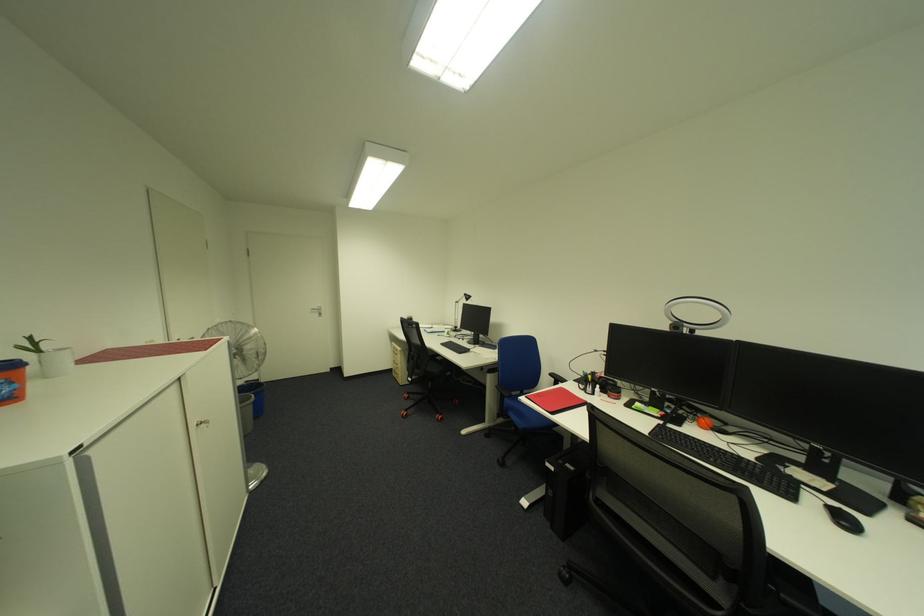
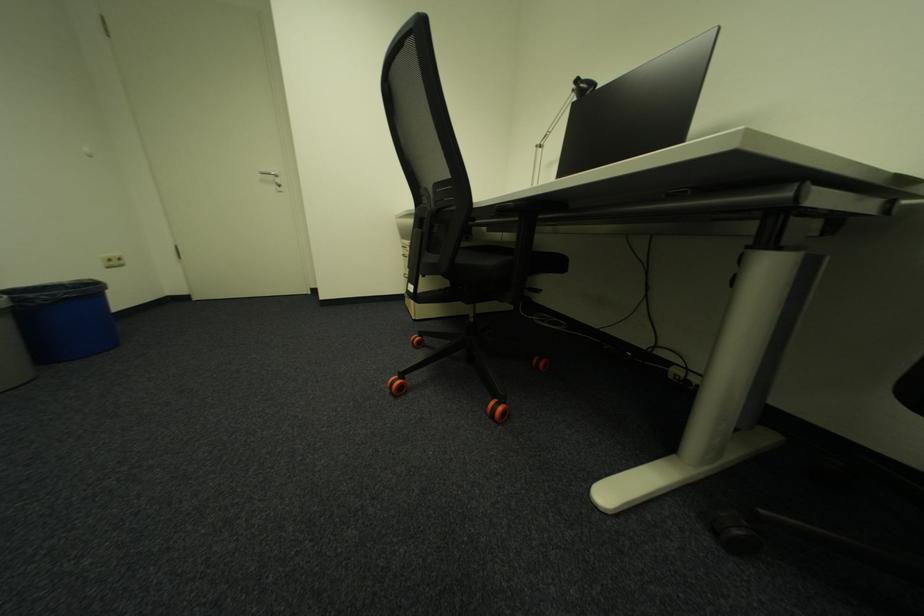
Question: What movement of the cameraman would produce the second image?

Choices:
 (A) Left
 (B) Right
 (C) Forward
 (D) Backward

Answer: (C)